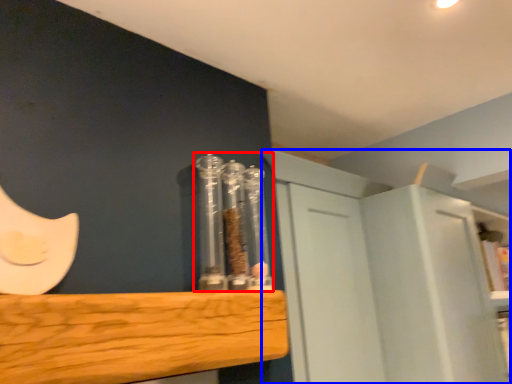
Question: Which object appears closest to the camera in this image, glass jar (highlighted by a red box) or cabinetry (highlighted by a blue box)?

Choices:
 (A) glass jar
 (B) cabinetry

Answer: (A)